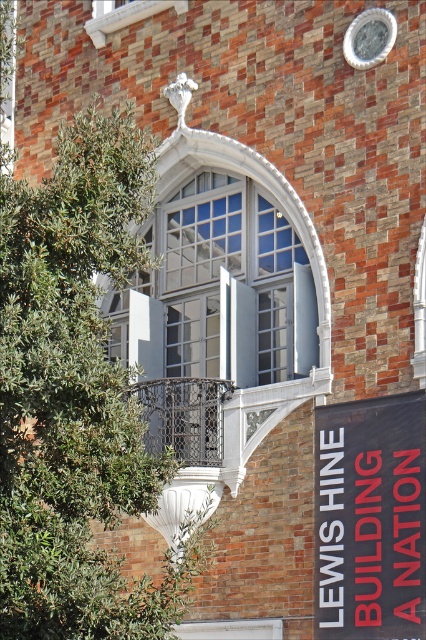
Is black fabric banner at lower right below silver metallic clock at upper center?

Yes.

Who is positioned more to the right, black fabric banner at lower right or silver metallic clock at upper center?

From the viewer's perspective, silver metallic clock at upper center appears more on the right side.

At what (x,y) coordinates should I click in order to perform the action: click on black fabric banner at lower right. Please return your answer as a coordinate pair (x, y). The width and height of the screenshot is (426, 640). Looking at the image, I should click on (370, 518).

The height and width of the screenshot is (640, 426). I want to click on black fabric banner at lower right, so click(370, 518).

Describe the element at coordinates (75, 396) in the screenshot. I see `green leafy tree at left` at that location.

Which is in front, point (34, 330) or point (382, 17)?

Point (34, 330) is more forward.

Find the location of a particular element. The height and width of the screenshot is (640, 426). green leafy tree at left is located at coordinates (75, 396).

Is green leafy tree at left smaller than black fabric banner at lower right?

Actually, green leafy tree at left might be larger than black fabric banner at lower right.

Which of these two, green leafy tree at left or black fabric banner at lower right, stands taller?

Standing taller between the two is green leafy tree at left.

Where is `green leafy tree at left`? The image size is (426, 640). green leafy tree at left is located at coordinates (75, 396).